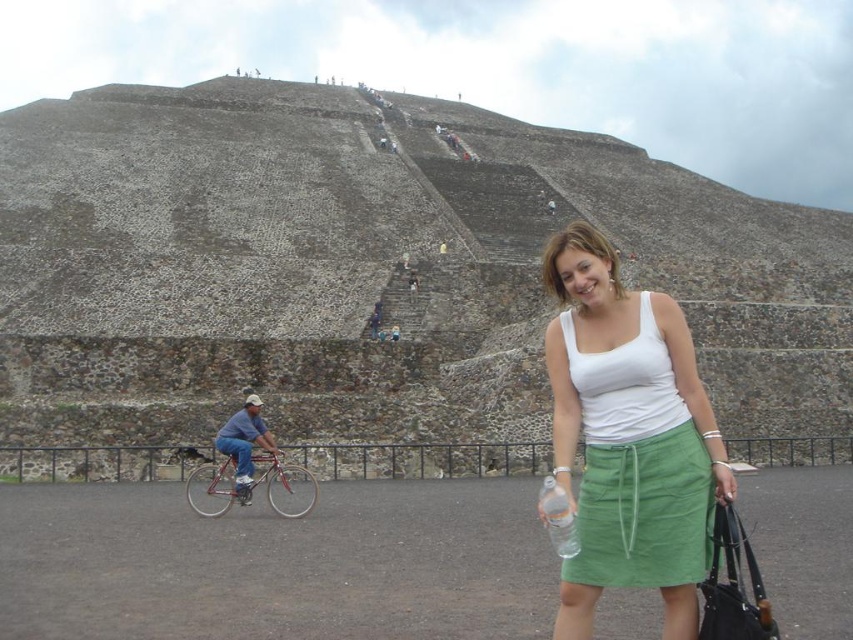
Is point (595, 378) closer to viewer compared to point (573, 536)?

That is False.

Which is above, white cotton tank top at center or clear plastic bottle at center?

Positioned higher is white cotton tank top at center.

Locate an element on the screen. white cotton tank top at center is located at coordinates (628, 436).

Does white cotton tank top at center have a smaller size compared to shiny red bicycle at left?

No.

Who is more forward, (680, 364) or (206, 461)?

Point (680, 364) is in front.

In order to click on white cotton tank top at center in this screenshot , I will do [x=628, y=436].

Is shiny red bicycle at left wider than clear plastic bottle at center?

Indeed, shiny red bicycle at left has a greater width compared to clear plastic bottle at center.

The height and width of the screenshot is (640, 853). Describe the element at coordinates (248, 486) in the screenshot. I see `shiny red bicycle at left` at that location.

Is point (198, 513) positioned after point (561, 493)?

Yes, point (198, 513) is farther from viewer.

Find the location of a particular element. The height and width of the screenshot is (640, 853). shiny red bicycle at left is located at coordinates (248, 486).